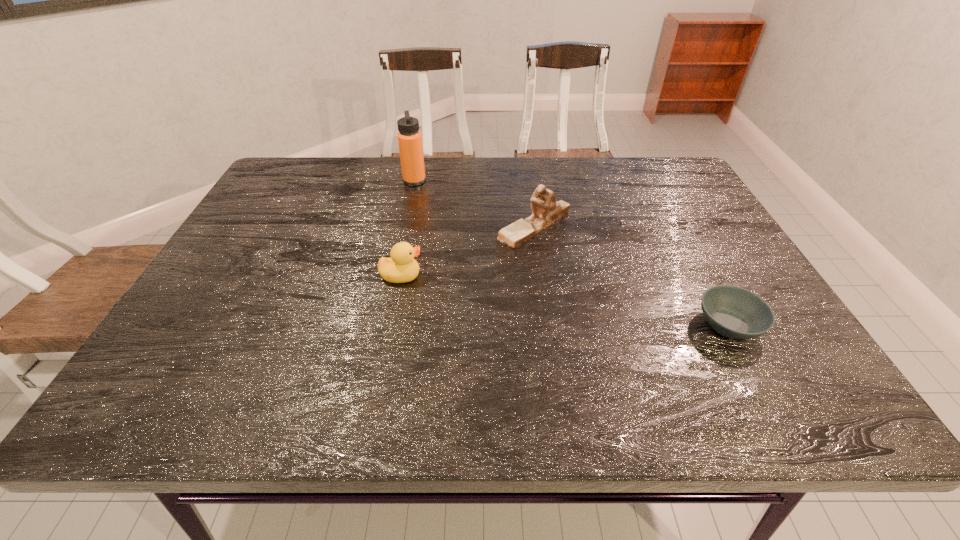
The image size is (960, 540). Find the location of `free space between the farthest object and the soup bowl`. free space between the farthest object and the soup bowl is located at coordinates (571, 253).

Identify the location of empty location between the farthest object and the nearest object. This screenshot has width=960, height=540. (571, 253).

Image resolution: width=960 pixels, height=540 pixels. Find the location of `object that ranks as the third closest to the second object from right to left`. object that ranks as the third closest to the second object from right to left is located at coordinates (734, 312).

Identify which object is located as the third nearest to the figurine. Please provide its 2D coordinates. Your answer should be formatted as a tuple, i.e. [(x, y)], where the tuple contains the x and y coordinates of a point satisfying the conditions above.

[(734, 312)]

At what (x,y) coordinates should I click in order to perform the action: click on free space in the image that satisfies the following two spatial constraints: 1. on the front-facing side of the second object from right to left; 2. on the right side of the shortest object. Please return your answer as a coordinate pair (x, y). Looking at the image, I should click on (549, 325).

This screenshot has height=540, width=960. Identify the location of vacant region that satisfies the following two spatial constraints: 1. on the front-facing side of the rightmost object; 2. on the left side of the third nearest object. (549, 325).

At what (x,y) coordinates should I click in order to perform the action: click on free space in the image that satisfies the following two spatial constraints: 1. on the front-facing side of the nearest object; 2. on the right side of the second farthest object. Please return your answer as a coordinate pair (x, y). Looking at the image, I should click on (549, 325).

This screenshot has width=960, height=540. Identify the location of vacant area that satisfies the following two spatial constraints: 1. on the front-facing side of the rightmost object; 2. on the right side of the figurine. (549, 325).

Where is `free space that satisfies the following two spatial constraints: 1. on the front-facing side of the figurine; 2. on the back side of the shortest object`? free space that satisfies the following two spatial constraints: 1. on the front-facing side of the figurine; 2. on the back side of the shortest object is located at coordinates (549, 325).

The width and height of the screenshot is (960, 540). Identify the location of vacant region that satisfies the following two spatial constraints: 1. on the back side of the nearest object; 2. at the beak of the third farthest object. (702, 276).